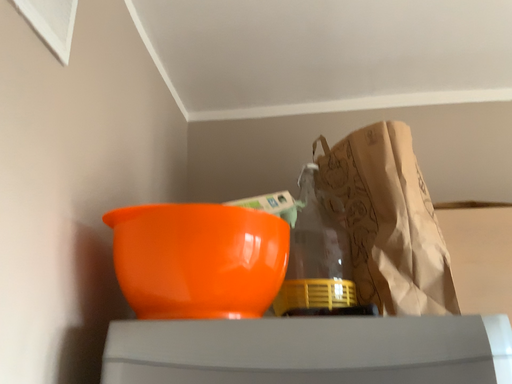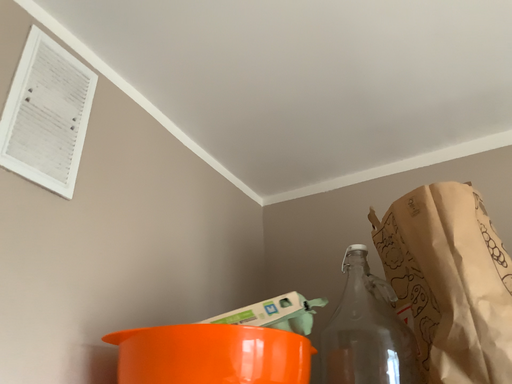
Question: Which way did the camera rotate in the video?

Choices:
 (A) rotated right
 (B) rotated left

Answer: (B)